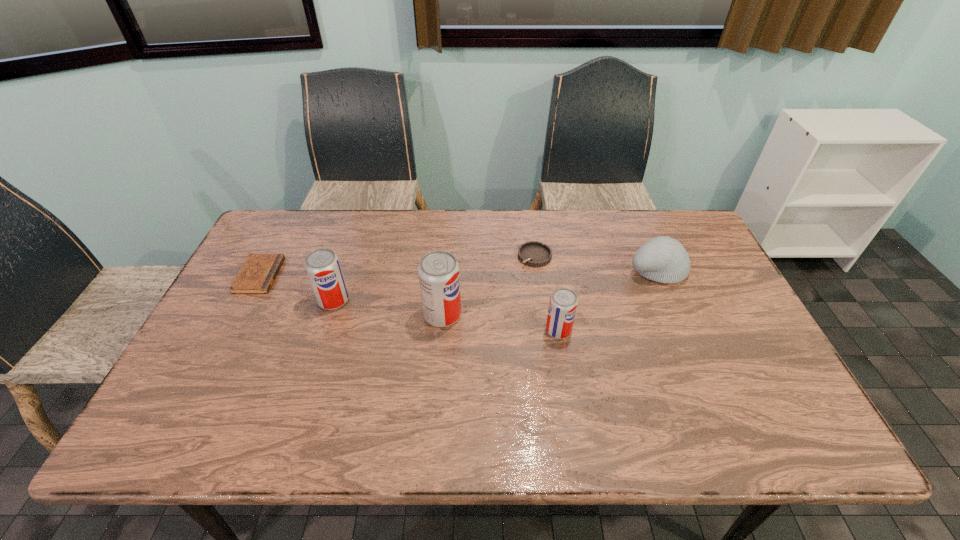
This screenshot has width=960, height=540. Identify the location of the second tallest soda. (322, 265).

Where is `the fifth shortest object`? This screenshot has width=960, height=540. the fifth shortest object is located at coordinates (322, 265).

Where is `the tallest soda`? The width and height of the screenshot is (960, 540). the tallest soda is located at coordinates (439, 279).

This screenshot has height=540, width=960. Identify the location of the second soda from right to left. (439, 279).

Identify the location of the shortest soda. pyautogui.click(x=563, y=303).

At what (x,y) coordinates should I click in order to perform the action: click on the rightmost object. Please return your answer as a coordinate pair (x, y). Looking at the image, I should click on [663, 259].

Where is `ashtray`? ashtray is located at coordinates (533, 253).

The image size is (960, 540). In order to click on diary in this screenshot , I will do `click(257, 275)`.

At what (x,y) coordinates should I click in order to perform the action: click on the shortest object. Please return your answer as a coordinate pair (x, y). Looking at the image, I should click on (257, 275).

The image size is (960, 540). I want to click on free point located 0.320m on the back of the leftmost soda, so click(x=359, y=223).